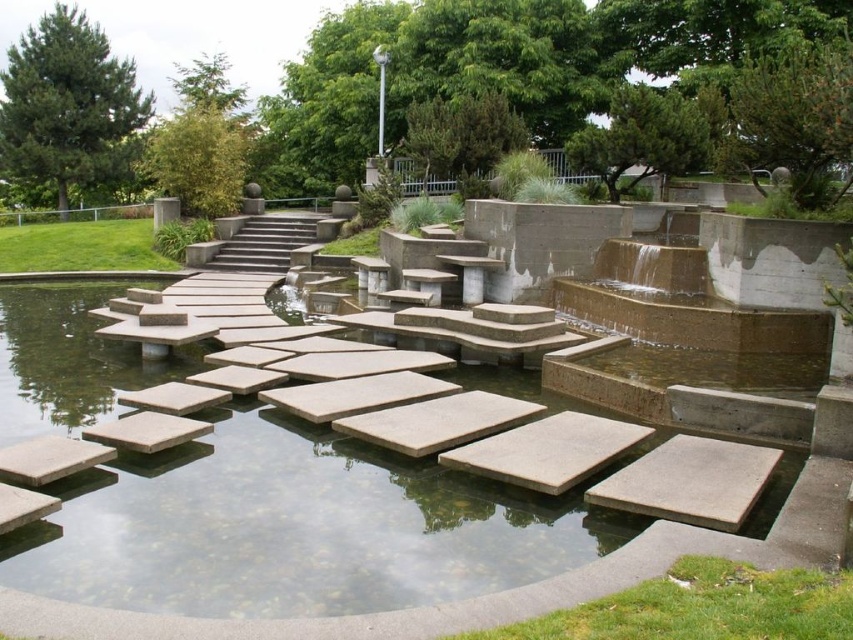
Is smooth concrete pond at center to the right of concrete stairs at center from the viewer's perspective?

Yes, smooth concrete pond at center is to the right of concrete stairs at center.

Is smooth concrete pond at center to the left of concrete stairs at center from the viewer's perspective?

No, smooth concrete pond at center is not to the left of concrete stairs at center.

Between point (175, 456) and point (274, 243), which one is positioned in front?

Point (175, 456) is more forward.

The width and height of the screenshot is (853, 640). I want to click on smooth concrete pond at center, so click(x=299, y=525).